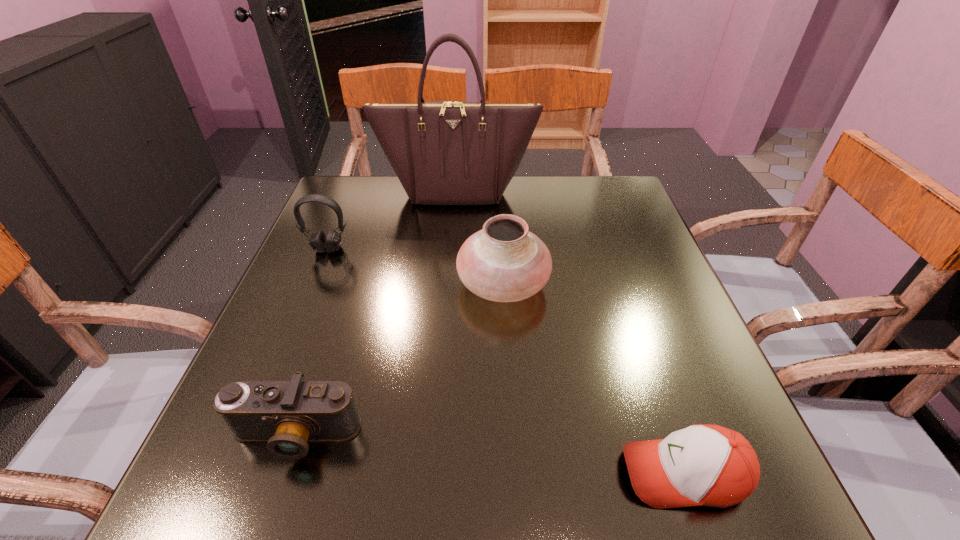
Image resolution: width=960 pixels, height=540 pixels. In order to click on free space between the rightmost object and the tallest object in this screenshot , I will do `click(570, 333)`.

I want to click on vacant point located between the handbag and the camera, so click(x=375, y=314).

At what (x,y) coordinates should I click in order to perform the action: click on free spot between the camera and the baseball cap. Please return your answer as a coordinate pair (x, y). Looking at the image, I should click on (490, 455).

Find the location of a particular element. The image size is (960, 540). free space between the pottery and the baseball cap is located at coordinates (593, 379).

Where is `blank region between the rightmost object and the headset`? The image size is (960, 540). blank region between the rightmost object and the headset is located at coordinates (506, 361).

The width and height of the screenshot is (960, 540). I want to click on free space that is in between the headset and the pottery, so click(416, 266).

Locate an element on the screen. object that stands as the third closest to the headset is located at coordinates (287, 414).

You are a GUI agent. You are given a task and a screenshot of the screen. Output one action in this format:
    pyautogui.click(x=<x>, y=<y>)
    Task: Click on the object that stands as the closest to the rightmost object
    This screenshot has height=540, width=960.
    Given the screenshot: What is the action you would take?
    pyautogui.click(x=504, y=262)